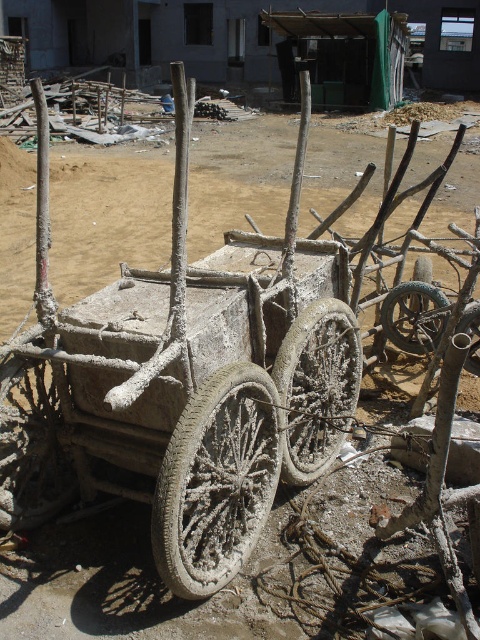
You are a construction worker who needs to choose between the gray concrete wheel at center and the white dusty wheel at center for a new vehicle. Which wheel should you pick if you want the wider one?

The gray concrete wheel at center has a larger width than the white dusty wheel at center, so you should pick the gray concrete wheel at center.

You are an inspector at the construction site and need to check the wheels of the makeshift vehicle. Which wheel should you examine first, the gray textured wheel at center or the rusty metal wheel at center?

You should examine the gray textured wheel at center first because it is closer to the viewer than the rusty metal wheel at center.

You are a construction worker who needs to move a heavy tool from the gray textured wheel at center to the rusty metal wheel at center. The tool requires a clear path that is at least 2 meters wide. Based on the scene, can you safely move the tool between these two wheels?

The gray textured wheel at center and rusty metal wheel at center are 1.96 meters apart from each other. Since the required clear path is 2 meters, the distance is insufficient. Therefore, moving the tool between them may not be safe due to the narrow space.